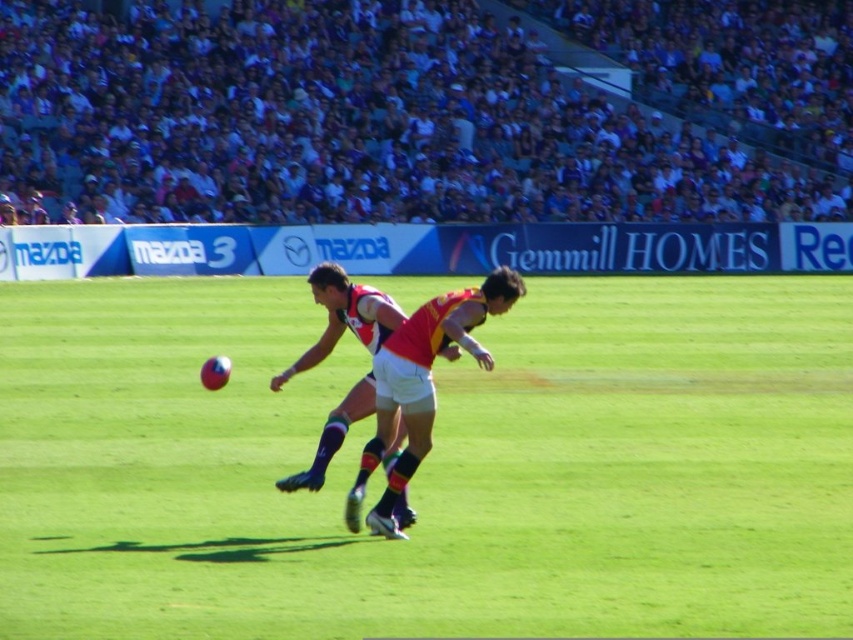
You are a sports analyst observing an Australian Rules Football match. You notice two players in red jerseys at the center of the field. Which player, the red jersey at center or the red and white jersey at center, is shorter?

The red jersey at center is shorter than the red and white jersey at center.

You are an athlete standing at the edge of the field. You need to run to the green grass field at center. What direction should you head towards?

The green grass field at center is located at point [431,467], so you should head towards the coordinates [431,467] to reach it.

You are a sports analyst watching the match. You notice a point marked at coordinates [421,385]. Which player is located at that point?

The point at [421,385] indicates the location of the red jersey at center.